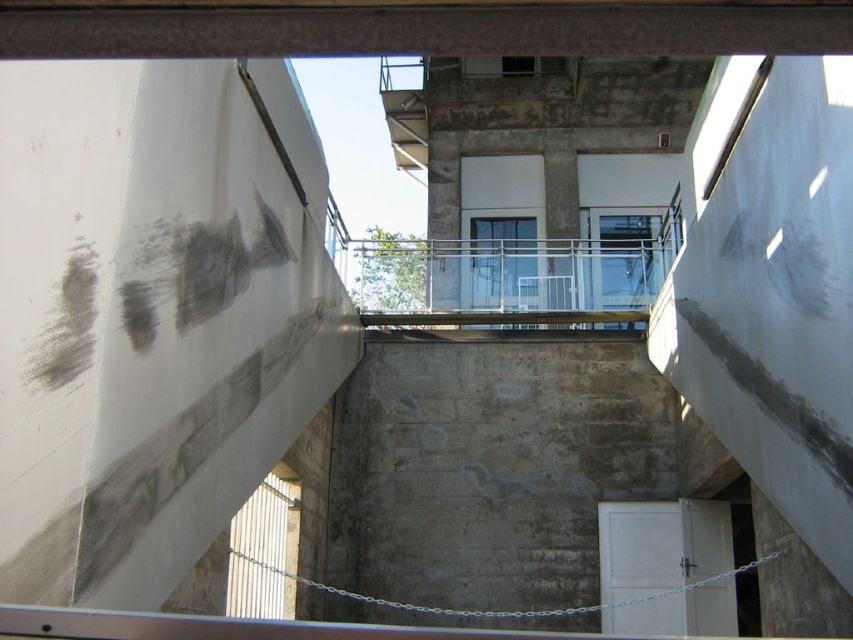
Question: Among these objects, which one is nearest to the camera?

Choices:
 (A) gray concrete wall at center
 (B) clear glass balcony at center

Answer: (A)

Question: Is gray concrete wall at center to the right of clear glass balcony at center from the viewer's perspective?

Choices:
 (A) yes
 (B) no

Answer: (B)

Question: Where is gray concrete wall at center located in relation to clear glass balcony at center in the image?

Choices:
 (A) right
 (B) left

Answer: (B)

Question: Which point is farther to the camera?

Choices:
 (A) (403, 308)
 (B) (656, 467)

Answer: (A)

Question: Where is gray concrete wall at center located in relation to clear glass balcony at center in the image?

Choices:
 (A) above
 (B) below

Answer: (B)